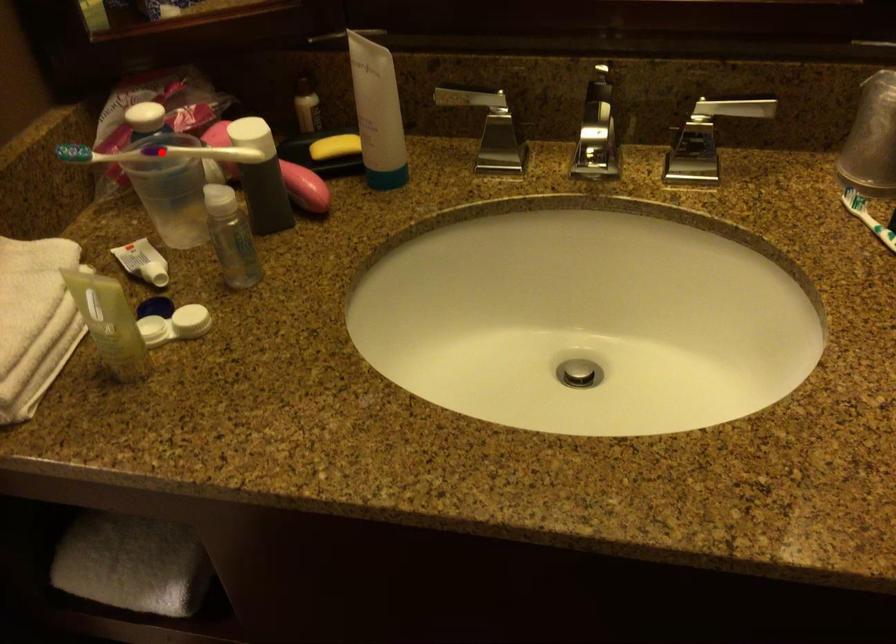
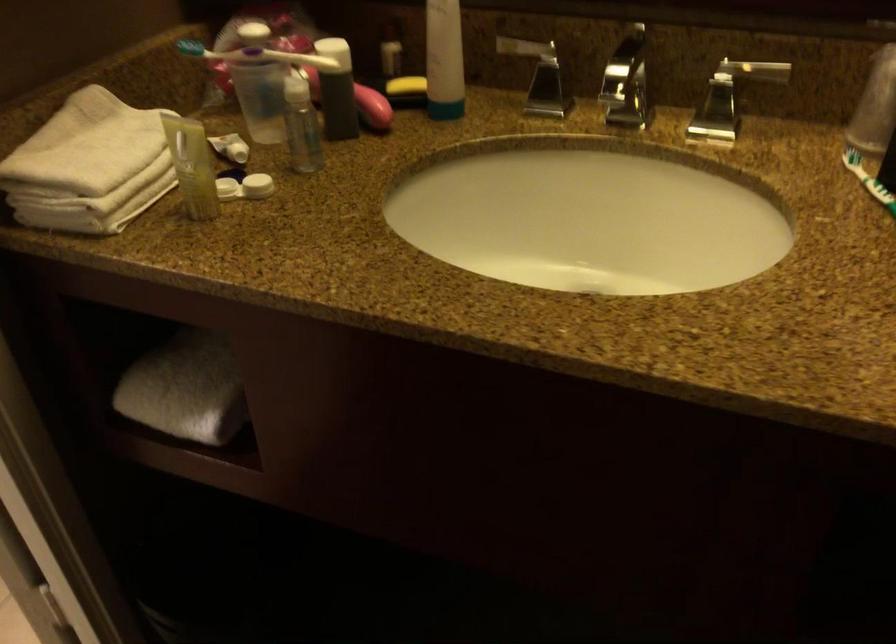
Where in the second image is the point corresponding to the highlighted location from the first image?

(259, 55)